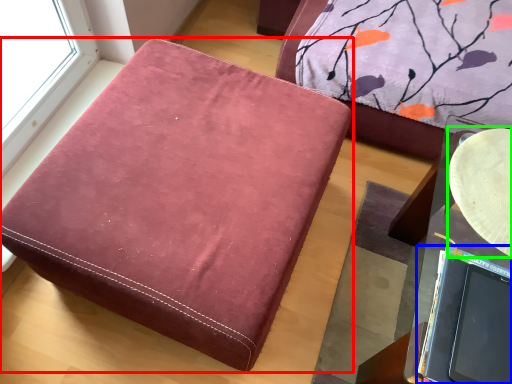
Question: Estimate the real-world distances between objects in this image. Which object is farther from furniture (highlighted by a red box), laptop (highlighted by a blue box) or round table (highlighted by a green box)?

Choices:
 (A) laptop
 (B) round table

Answer: (B)